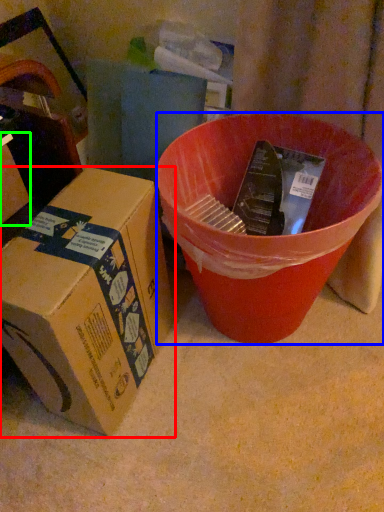
Question: Considering the real-world distances, which object is farthest from box (highlighted by a red box)? bucket (highlighted by a blue box) or box (highlighted by a green box)?

Choices:
 (A) bucket
 (B) box

Answer: (B)